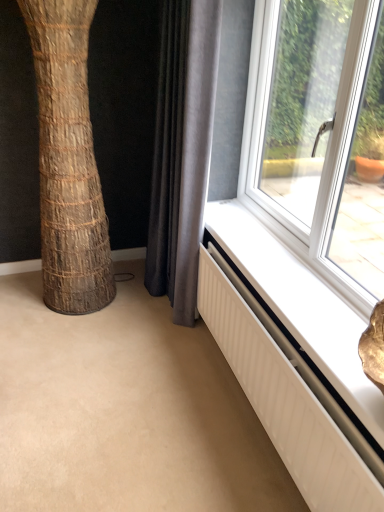
Question: Considering the relative positions of brown textured tree trunk at left and white textured radiator at lower right in the image provided, is brown textured tree trunk at left to the left or to the right of white textured radiator at lower right?

Choices:
 (A) left
 (B) right

Answer: (A)

Question: From a real-world perspective, relative to white textured radiator at lower right, is brown textured tree trunk at left vertically above or below?

Choices:
 (A) above
 (B) below

Answer: (A)

Question: Which is nearer to the brown textured tree trunk at left?

Choices:
 (A) gray fabric curtain at lower center
 (B) white textured radiator at lower right

Answer: (A)

Question: Which object is positioned closest to the gray fabric curtain at lower center?

Choices:
 (A) brown textured tree trunk at left
 (B) white textured radiator at lower right

Answer: (A)